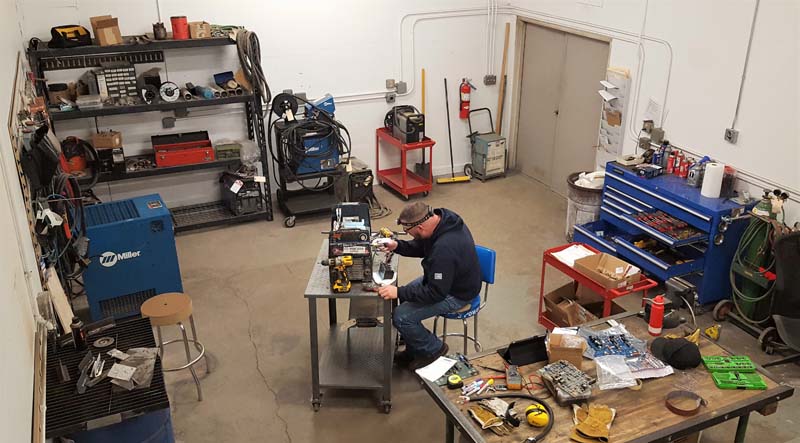
The width and height of the screenshot is (800, 443). In order to click on floor in this screenshot , I will do `click(233, 325)`.